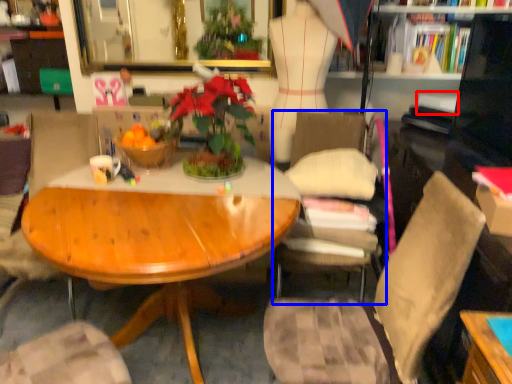
Question: Which object is closer to the camera taking this photo, book (highlighted by a red box) or chair (highlighted by a blue box)?

Choices:
 (A) book
 (B) chair

Answer: (B)